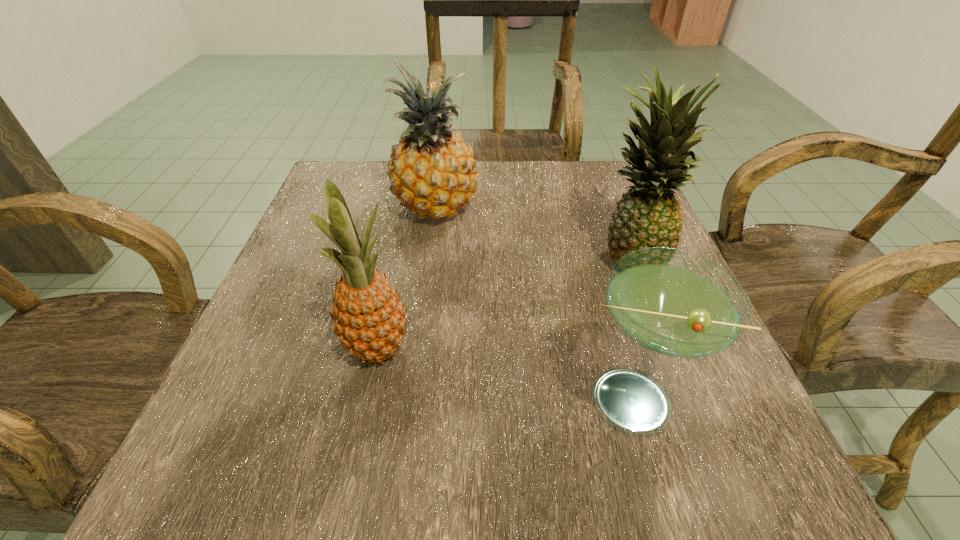
Locate an element on the screen. Image resolution: width=960 pixels, height=540 pixels. martini present at the right edge is located at coordinates pyautogui.click(x=673, y=303).

The width and height of the screenshot is (960, 540). Identify the location of object that is at the near right corner. (673, 303).

Find the location of a particular element. This screenshot has height=540, width=960. vacant space at the far edge of the desktop is located at coordinates (559, 160).

The height and width of the screenshot is (540, 960). I want to click on free space at the left edge of the desktop, so click(x=312, y=294).

The image size is (960, 540). In the image, there is a desktop. Find the location of `vacant space at the right edge`. vacant space at the right edge is located at coordinates (697, 375).

Image resolution: width=960 pixels, height=540 pixels. Find the location of `vacant space at the far left corner of the desktop`. vacant space at the far left corner of the desktop is located at coordinates (353, 184).

Find the location of a particular element. The height and width of the screenshot is (540, 960). vacant region at the near left corner of the desktop is located at coordinates (174, 481).

The height and width of the screenshot is (540, 960). Identify the location of vacant space at the near right corner of the desktop. (765, 466).

Locate an element on the screen. empty space that is in between the rightmost pineapple and the nearest pineapple is located at coordinates (503, 302).

Find the location of `free space between the nearest pineapple and the shortest object`. free space between the nearest pineapple and the shortest object is located at coordinates click(501, 375).